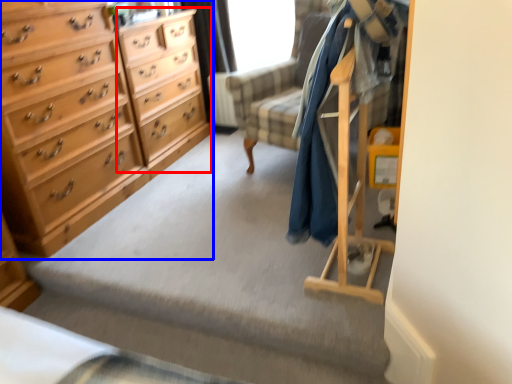
Question: Among these objects, which one is nearest to the camera, file cabinet (highlighted by a red box) or chest of drawers (highlighted by a blue box)?

Choices:
 (A) file cabinet
 (B) chest of drawers

Answer: (B)